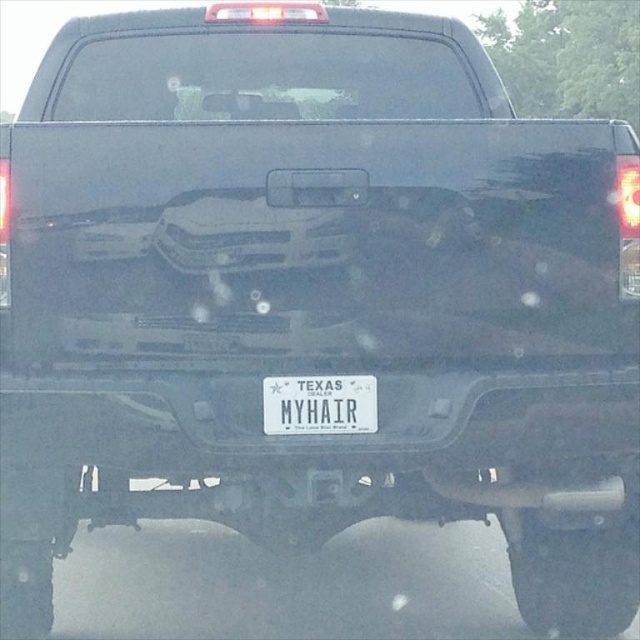
You are a delivery person trying to attach a GPS tracker to the rear of the truck. The GPS tracker is designed to be placed on the bumper. However, you need to confirm the exact location. Given the white plastic bumper at center and the white plastic license plate at center, which one is located to the right of the other?

The white plastic bumper at center is positioned on the right side of the white plastic license plate at center, so the bumper is to the right of the license plate.

You are a delivery person who needs to attach a package to the rear of the pickup truck. The package requires a secure attachment point. Given the white plastic bumper at center and the white plastic license plate at center, which one is closer to the center of the truck bed where you need to place the package?

The white plastic bumper at center is 13.41 centimeters away from the white plastic license plate at center. Since the bumper is closer to the center of the truck bed, you should attach the package there for better security.